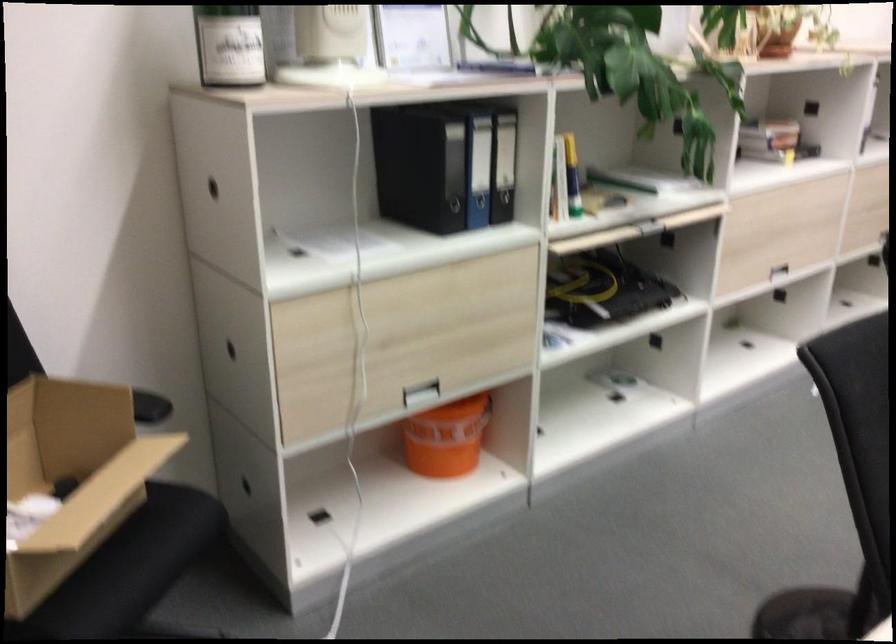
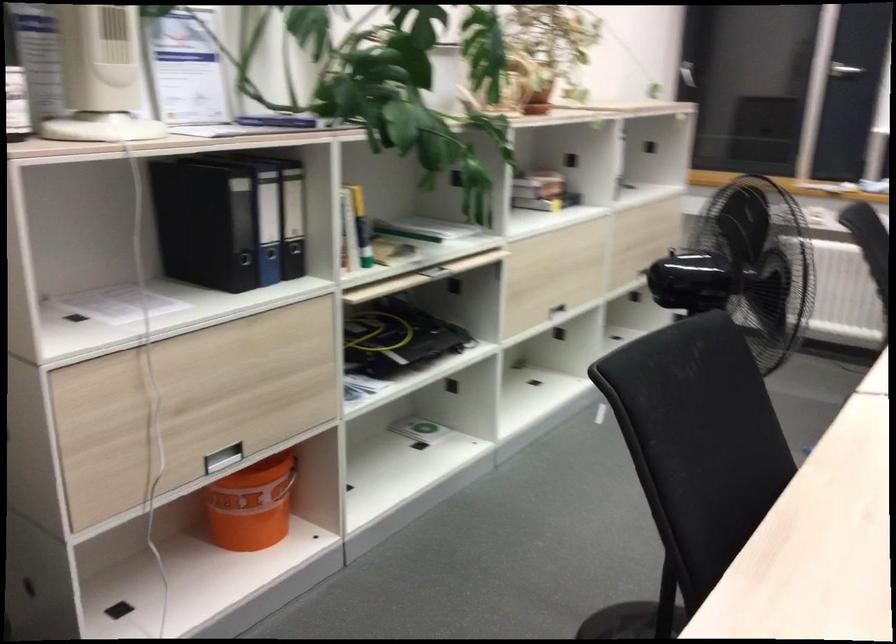
The images are taken continuously from a first-person perspective. In which direction are you moving?

The movement direction of the cameraman is left, forward.